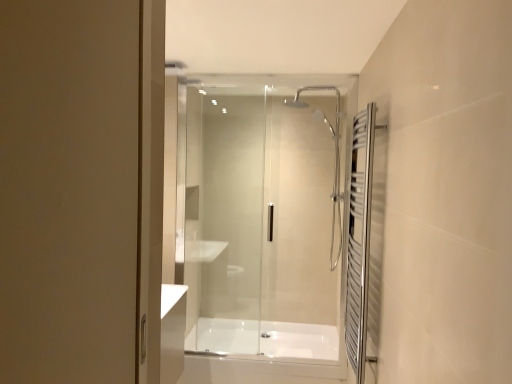
Question: From a real-world perspective, is polished chrome towel rack at right positioned under white glossy bathtub at center based on gravity?

Choices:
 (A) yes
 (B) no

Answer: (B)

Question: Is polished chrome towel rack at right far away from white glossy bathtub at center?

Choices:
 (A) yes
 (B) no

Answer: (A)

Question: Is polished chrome towel rack at right outside of white glossy bathtub at center?

Choices:
 (A) yes
 (B) no

Answer: (A)

Question: Would you say polished chrome towel rack at right contains white glossy bathtub at center?

Choices:
 (A) yes
 (B) no

Answer: (B)

Question: Can you confirm if polished chrome towel rack at right is shorter than white glossy bathtub at center?

Choices:
 (A) yes
 (B) no

Answer: (B)

Question: Considering their positions, is white glossy bathtub at center located in front of or behind transparent glass shower door at center?

Choices:
 (A) front
 (B) behind

Answer: (B)

Question: Considering the positions of point pos(216,334) and point pos(262,241), is point pos(216,334) closer or farther from the camera than point pos(262,241)?

Choices:
 (A) closer
 (B) farther

Answer: (A)

Question: In terms of height, does white glossy bathtub at center look taller or shorter compared to transparent glass shower door at center?

Choices:
 (A) tall
 (B) short

Answer: (B)

Question: From the image's perspective, relative to transparent glass shower door at center, is white glossy bathtub at center above or below?

Choices:
 (A) below
 (B) above

Answer: (A)

Question: Considering their positions, is polished chrome towel rack at right located in front of or behind transparent glass shower door at center?

Choices:
 (A) behind
 (B) front

Answer: (B)

Question: Considering the positions of polished chrome towel rack at right and transparent glass shower door at center in the image, is polished chrome towel rack at right taller or shorter than transparent glass shower door at center?

Choices:
 (A) tall
 (B) short

Answer: (B)

Question: Looking at the image, does polished chrome towel rack at right seem bigger or smaller compared to transparent glass shower door at center?

Choices:
 (A) big
 (B) small

Answer: (B)

Question: Is polished chrome towel rack at right wider or thinner than transparent glass shower door at center?

Choices:
 (A) wide
 (B) thin

Answer: (A)

Question: From their relative heights in the image, would you say white glossy bathtub at center is taller or shorter than polished chrome towel rack at right?

Choices:
 (A) tall
 (B) short

Answer: (B)

Question: From a real-world perspective, is white glossy bathtub at center positioned above or below polished chrome towel rack at right?

Choices:
 (A) above
 (B) below

Answer: (B)